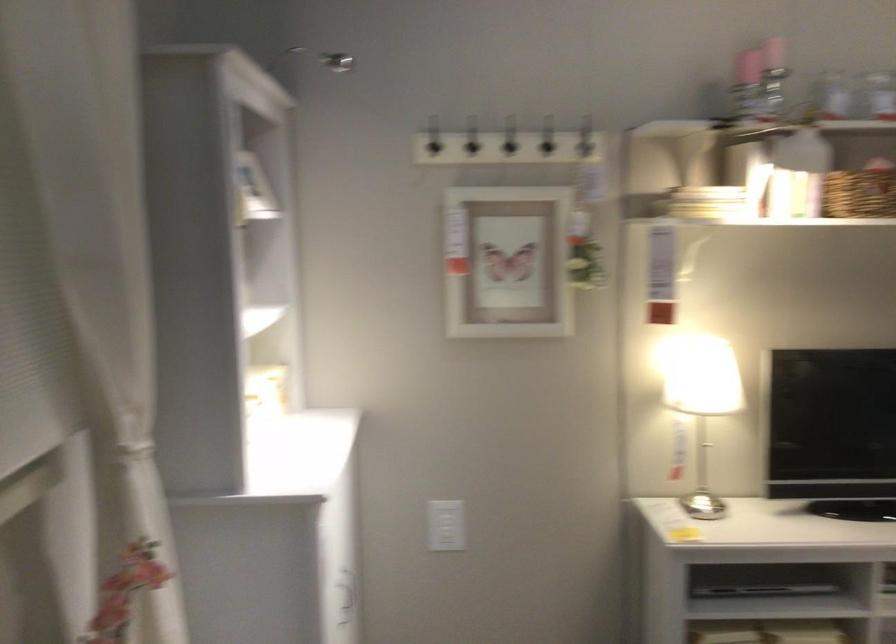
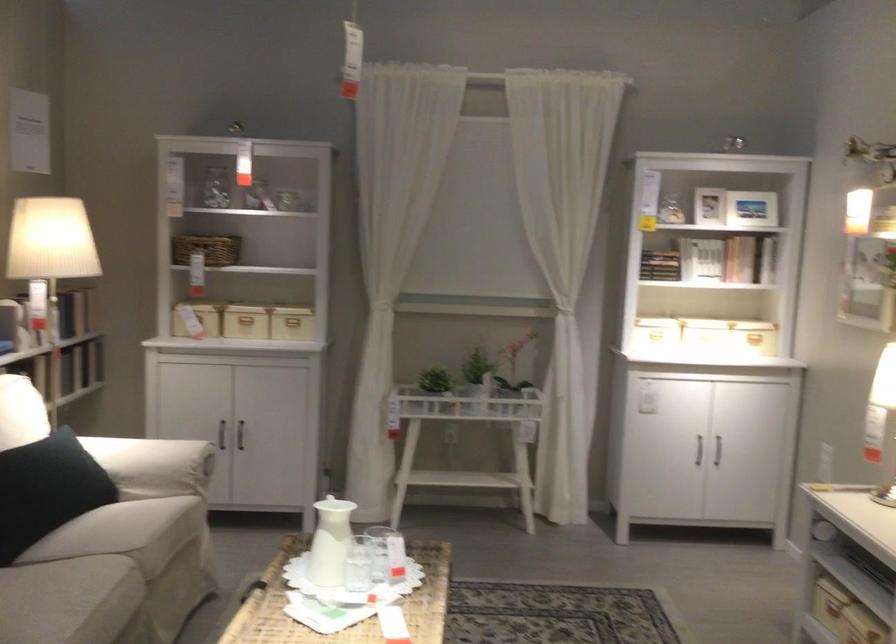
Where in the second image is the point corresponding to [229,316] from the first image?

(702, 259)